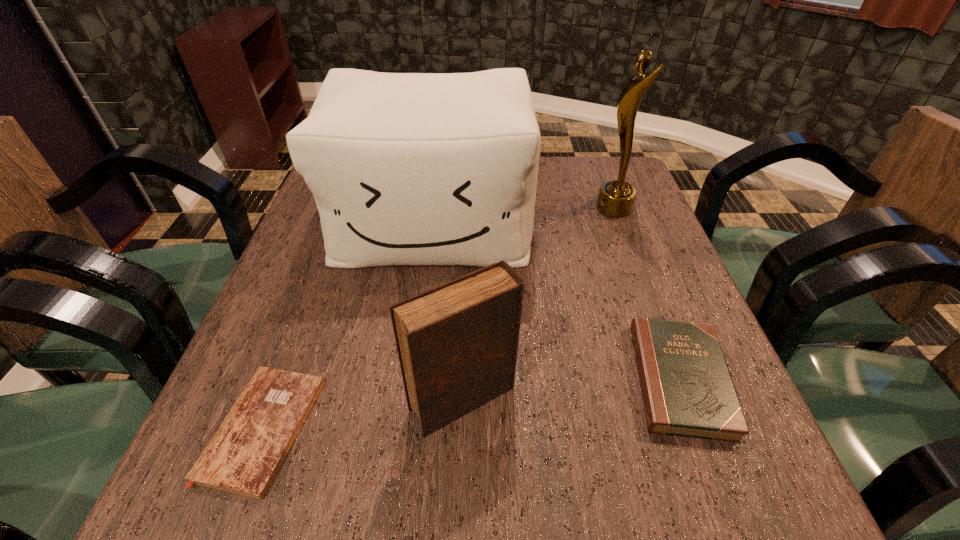
Where is `empty space that is in between the leftmost Bible and the third shortest object`? This screenshot has width=960, height=540. empty space that is in between the leftmost Bible and the third shortest object is located at coordinates (363, 414).

Where is `free space between the shortest Bible and the cushion`? The height and width of the screenshot is (540, 960). free space between the shortest Bible and the cushion is located at coordinates (348, 326).

Locate an element on the screen. free area in between the leftmost Bible and the cushion is located at coordinates (348, 326).

Find the location of a particular element. free point between the second tallest Bible and the award is located at coordinates (647, 294).

Image resolution: width=960 pixels, height=540 pixels. In order to click on free spot between the tallest Bible and the fourth tallest object in this screenshot , I will do `click(571, 389)`.

At what (x,y) coordinates should I click in order to perform the action: click on vacant region between the award and the second Bible from right to left. Please return your answer as a coordinate pair (x, y). Image resolution: width=960 pixels, height=540 pixels. Looking at the image, I should click on (539, 303).

In order to click on free point between the cushion and the second shortest Bible in this screenshot , I will do `click(556, 302)`.

The image size is (960, 540). In order to click on object that is the second closest to the cushion in this screenshot , I will do `click(687, 390)`.

In order to click on object that ranks as the second closest to the shortest Bible in this screenshot , I will do `click(406, 168)`.

Choose which Bible is the third nearest neighbor to the cushion. Please provide its 2D coordinates. Your answer should be formatted as a tuple, i.e. [(x, y)], where the tuple contains the x and y coordinates of a point satisfying the conditions above.

[(244, 455)]